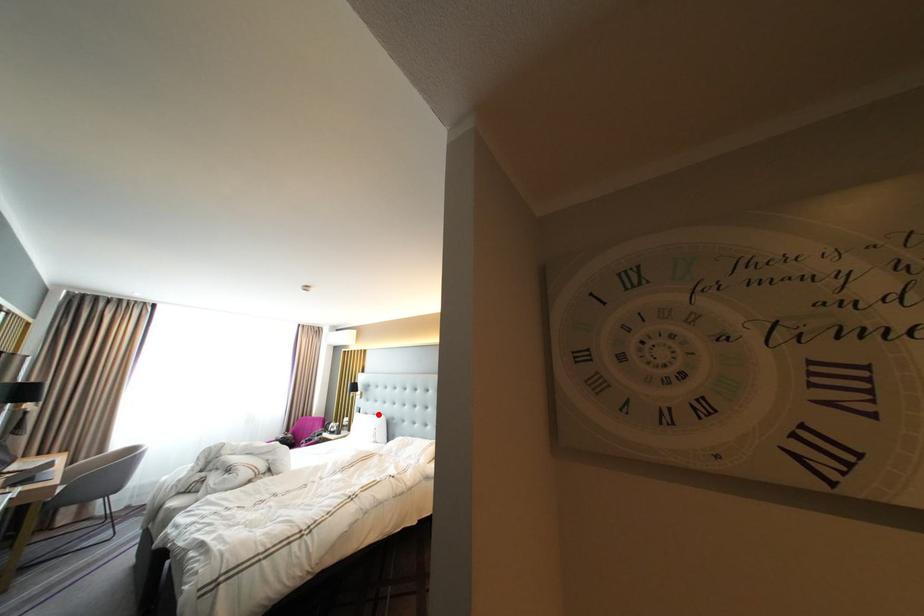
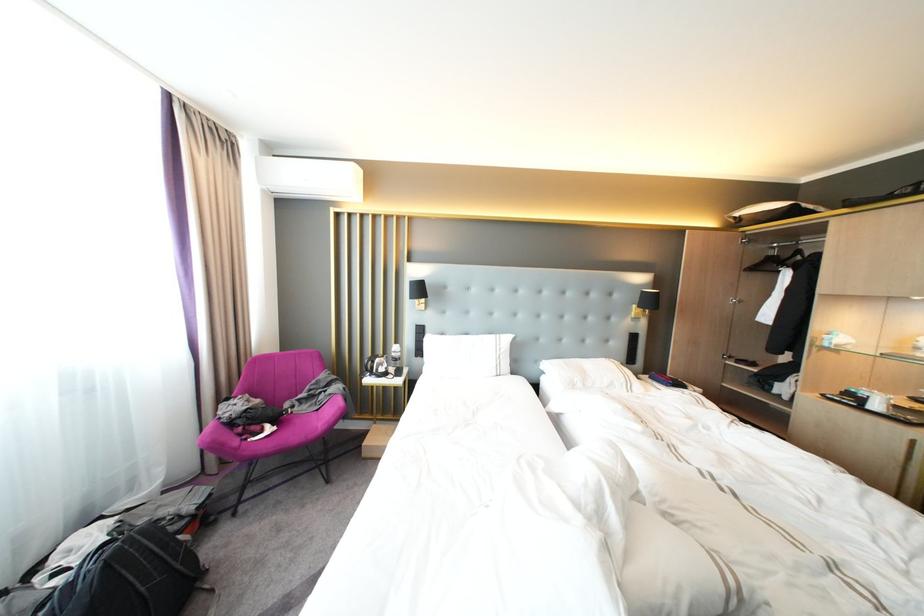
Question: I am providing you with two images of the same scene from different viewpoints. A red point is shown in image1. For the corresponding object point in image2, is it positioned nearer or farther from the camera?

Choices:
 (A) Nearer
 (B) Farther

Answer: (A)